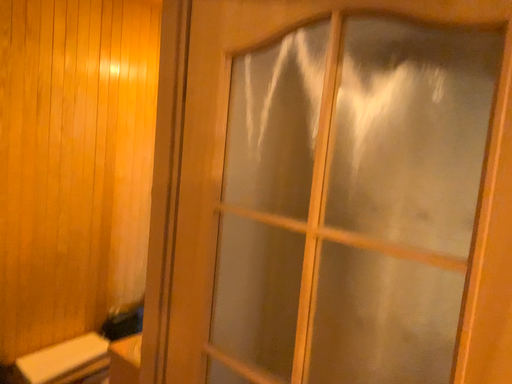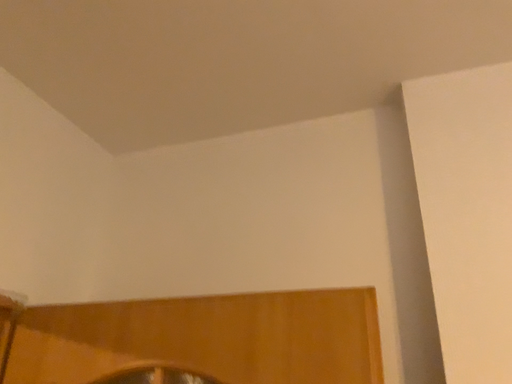
Question: Which way did the camera rotate in the video?

Choices:
 (A) rotated downward
 (B) rotated upward

Answer: (B)